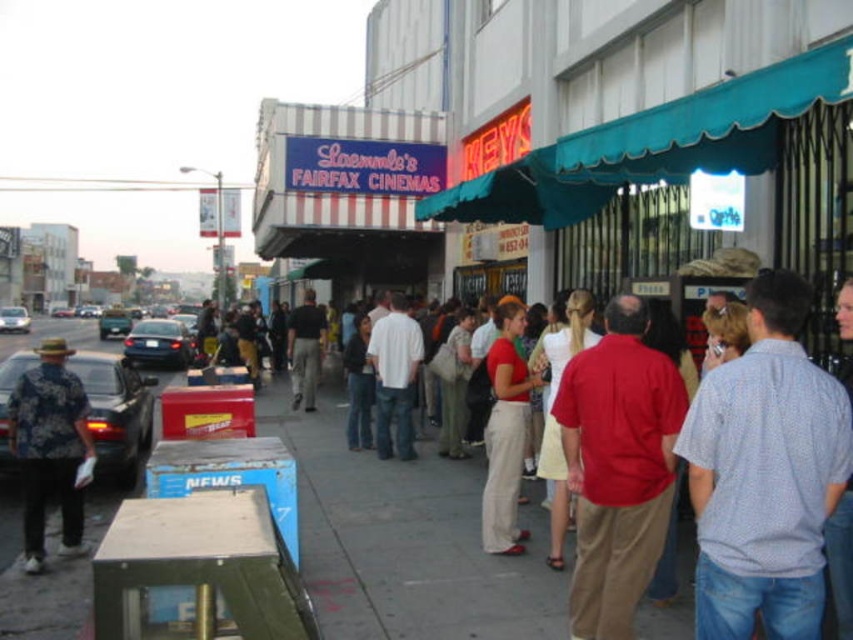
Question: Based on their relative distances, which object is nearer to the hawaiian print shirt at left?

Choices:
 (A) matte red shirt at center
 (B) shiny silver sedan at center-left
 (C) light blue dotted shirt at center-right
 (D) dark gray pants at center

Answer: (A)

Question: Does light blue dotted shirt at center-right lie behind teal fabric awning at upper right?

Choices:
 (A) no
 (B) yes

Answer: (A)

Question: Does matte red shirt at center have a greater width compared to hawaiian print shirt at left?

Choices:
 (A) yes
 (B) no

Answer: (A)

Question: Among these objects, which one is farthest from the camera?

Choices:
 (A) red shirt at center
 (B) shiny silver sedan at center-left
 (C) light blue dotted shirt at center-right

Answer: (B)

Question: Which of these objects is positioned farthest from the matte red shirt at center?

Choices:
 (A) teal fabric awning at upper right
 (B) white cotton shirt at center
 (C) dark gray pants at center

Answer: (C)

Question: Is teal fabric awning at upper right to the left of shiny black sedan at center-left from the viewer's perspective?

Choices:
 (A) no
 (B) yes

Answer: (A)